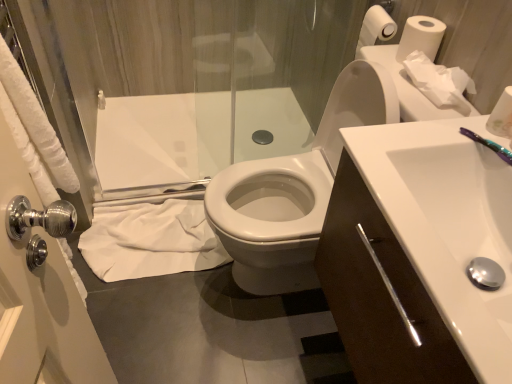
Question: Is purple plastic toothbrush at upper right at the right side of white glossy sink at center right?

Choices:
 (A) no
 (B) yes

Answer: (B)

Question: From the image's perspective, would you say purple plastic toothbrush at upper right is positioned over white glossy sink at center right?

Choices:
 (A) yes
 (B) no

Answer: (A)

Question: Can you confirm if purple plastic toothbrush at upper right is shorter than white glossy sink at center right?

Choices:
 (A) yes
 (B) no

Answer: (A)

Question: Considering the relative sizes of purple plastic toothbrush at upper right and white glossy sink at center right in the image provided, is purple plastic toothbrush at upper right wider than white glossy sink at center right?

Choices:
 (A) yes
 (B) no

Answer: (B)

Question: Does purple plastic toothbrush at upper right appear on the left side of white glossy sink at center right?

Choices:
 (A) yes
 (B) no

Answer: (B)

Question: In terms of size, does white matte toilet paper at upper right, acting as the first toilet paper starting from the bottom, appear bigger or smaller than white paper tissue at upper right, the second toilet paper positioned from the front?

Choices:
 (A) small
 (B) big

Answer: (A)

Question: From the image's perspective, is white matte toilet paper at upper right, acting as the first toilet paper starting from the bottom, positioned above or below white paper tissue at upper right, marked as the third toilet paper in a top-to-bottom arrangement?

Choices:
 (A) above
 (B) below

Answer: (B)

Question: Considering the positions of white matte toilet paper at upper right, acting as the first toilet paper starting from the bottom, and white paper tissue at upper right, which appears as the 2th toilet paper when ordered from the bottom, in the image, is white matte toilet paper at upper right, acting as the first toilet paper starting from the bottom, wider or thinner than white paper tissue at upper right, which appears as the 2th toilet paper when ordered from the bottom,?

Choices:
 (A) wide
 (B) thin

Answer: (B)

Question: Considering the positions of white matte toilet paper at upper right, positioned as the 4th toilet paper in top-to-bottom order, and white paper tissue at upper right, the second toilet paper positioned from the front, in the image, is white matte toilet paper at upper right, positioned as the 4th toilet paper in top-to-bottom order, taller or shorter than white paper tissue at upper right, the second toilet paper positioned from the front,?

Choices:
 (A) tall
 (B) short

Answer: (A)

Question: From a real-world perspective, is transparent glass shower door at upper left physically located above or below white paper tissue at upper right, positioned as the 3th toilet paper in back-to-front order?

Choices:
 (A) above
 (B) below

Answer: (B)

Question: Visually, is transparent glass shower door at upper left positioned to the left or to the right of white paper tissue at upper right, the second toilet paper positioned from the front?

Choices:
 (A) left
 (B) right

Answer: (A)

Question: Considering the positions of transparent glass shower door at upper left and white paper tissue at upper right, the second toilet paper positioned from the front, in the image, is transparent glass shower door at upper left wider or thinner than white paper tissue at upper right, the second toilet paper positioned from the front,?

Choices:
 (A) wide
 (B) thin

Answer: (B)

Question: From the image's perspective, relative to white paper tissue at upper right, positioned as the 3th toilet paper in back-to-front order, is transparent glass shower door at upper left above or below?

Choices:
 (A) above
 (B) below

Answer: (A)

Question: Which is correct: purple plastic toothbrush at upper right is inside white matte toilet paper at upper right, arranged as the first toilet paper when viewed from the front, or outside of it?

Choices:
 (A) outside
 (B) inside

Answer: (A)

Question: Is point [x=463, y=135] closer or farther from the camera than point [x=490, y=114]?

Choices:
 (A) closer
 (B) farther

Answer: (A)